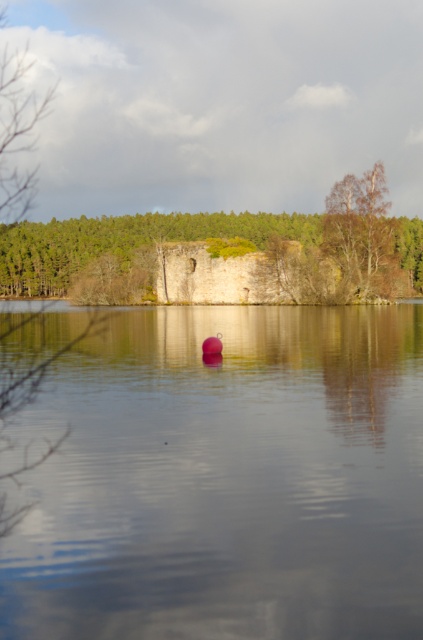
You are standing at the lakeside and want to walk from the smooth water at center to the bare wood tree at right. Which direction should you head towards?

You should head towards the right direction because the smooth water at center is to the left of the bare wood tree at right, so moving right would lead you towards the tree.

You are an artist planning to paint this lakeside scene. You want to ensure the smooth water at center and the bare wood tree at right are proportionally accurate. Which object should you make taller in your painting?

The bare wood tree at right should be made taller in the painting because the smooth water at center is not as tall as the bare wood tree at right according to the description.